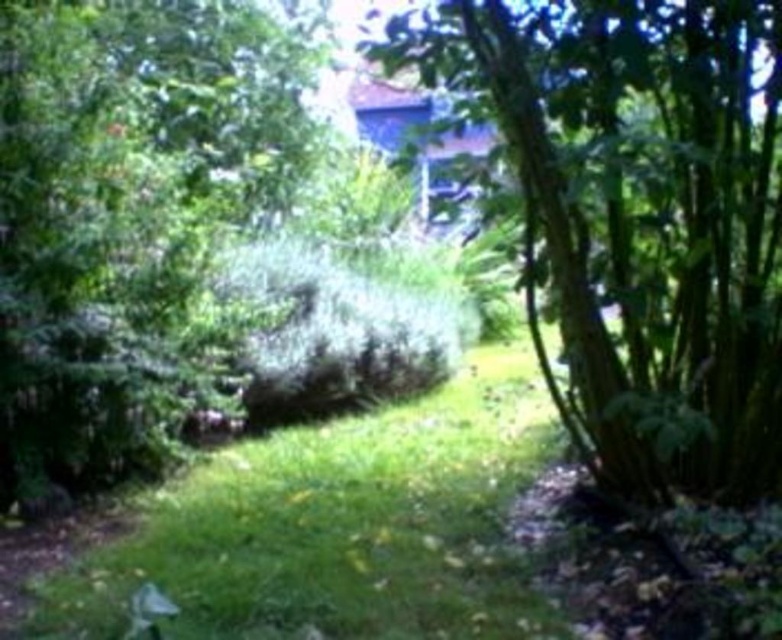
Question: Where is green leafy tree at center located in relation to green grass at center in the image?

Choices:
 (A) left
 (B) right

Answer: (B)

Question: Which of the following is the closest to the observer?

Choices:
 (A) (268, 540)
 (B) (741, 35)

Answer: (A)

Question: Is green leafy tree at center below green grass at center?

Choices:
 (A) no
 (B) yes

Answer: (A)

Question: Observing the image, what is the correct spatial positioning of green leafy tree at center in reference to green grass at center?

Choices:
 (A) right
 (B) left

Answer: (A)